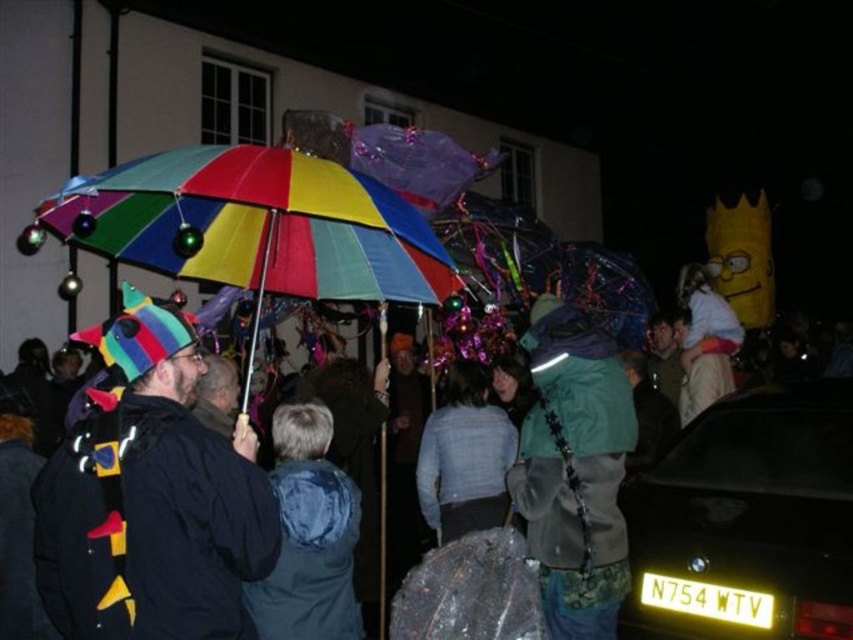
Find the location of a particular element. This screenshot has height=640, width=853. yellow plastic license plate at lower right is located at coordinates (747, 522).

Does yellow plastic license plate at lower right come behind green matte jacket at center?

That is False.

Where is `yellow plastic license plate at lower right`? Image resolution: width=853 pixels, height=640 pixels. yellow plastic license plate at lower right is located at coordinates (747, 522).

Identify the location of yellow plastic license plate at lower right. (747, 522).

Can you confirm if green matte jacket at center is taller than light blue fabric jacket at center?

Indeed, green matte jacket at center has a greater height compared to light blue fabric jacket at center.

Is point (511, 484) more distant than point (515, 433)?

No.

Does point (587, 572) lie in front of point (456, 518)?

Yes, it is.

Image resolution: width=853 pixels, height=640 pixels. In order to click on green matte jacket at center in this screenshot , I will do `click(573, 468)`.

Who is positioned more to the right, blue quilted jacket at center or white fluffy costume at upper right?

Positioned to the right is white fluffy costume at upper right.

Where is `blue quilted jacket at center`? blue quilted jacket at center is located at coordinates (308, 534).

Identify the location of blue quilted jacket at center. (308, 534).